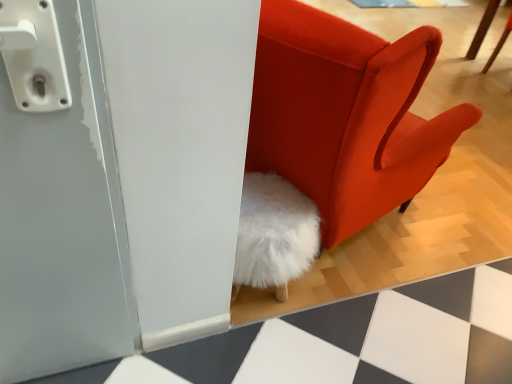
This screenshot has height=384, width=512. I want to click on vacant space underneath white fluffy chair at upper right (from a real-world perspective), so click(497, 76).